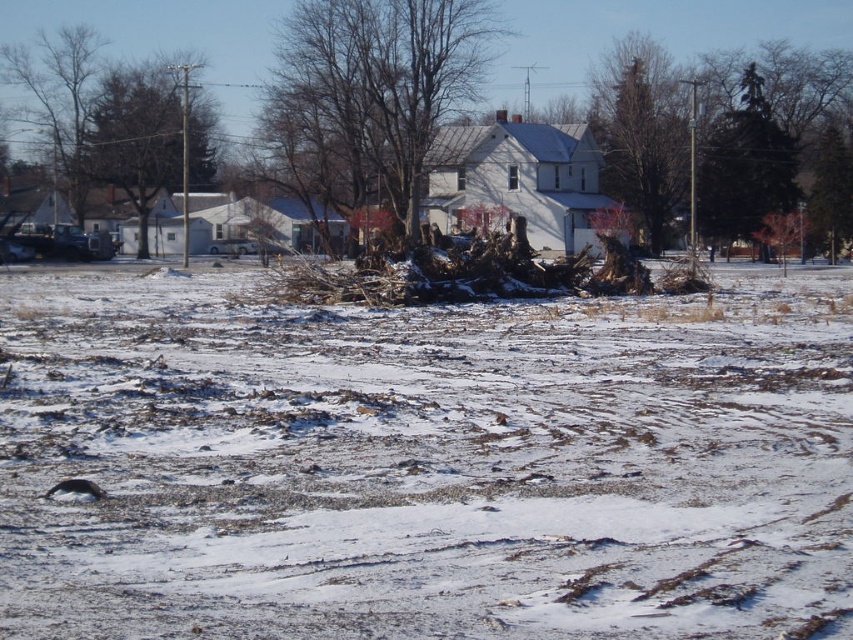
Who is taller, bare branches at center or green leafy tree at upper left?

bare branches at center is taller.

Is point (346, 90) behind point (125, 134)?

No, it is not.

At what (x,y) coordinates should I click in order to perform the action: click on bare branches at center. Please return your answer as a coordinate pair (x, y). Looking at the image, I should click on (369, 93).

Is green textured evergreen tree at upper center further to camera compared to green evergreen tree at upper right?

Yes, green textured evergreen tree at upper center is behind green evergreen tree at upper right.

Image resolution: width=853 pixels, height=640 pixels. Describe the element at coordinates (642, 136) in the screenshot. I see `green textured evergreen tree at upper center` at that location.

Where is `green textured evergreen tree at upper center`? This screenshot has width=853, height=640. green textured evergreen tree at upper center is located at coordinates (642, 136).

Does green textured tree at upper right have a lesser width compared to green evergreen tree at upper right?

No, green textured tree at upper right is not thinner than green evergreen tree at upper right.

What do you see at coordinates (758, 129) in the screenshot? The width and height of the screenshot is (853, 640). I see `green textured tree at upper right` at bounding box center [758, 129].

Locate an element on the screen. green textured tree at upper right is located at coordinates (758, 129).